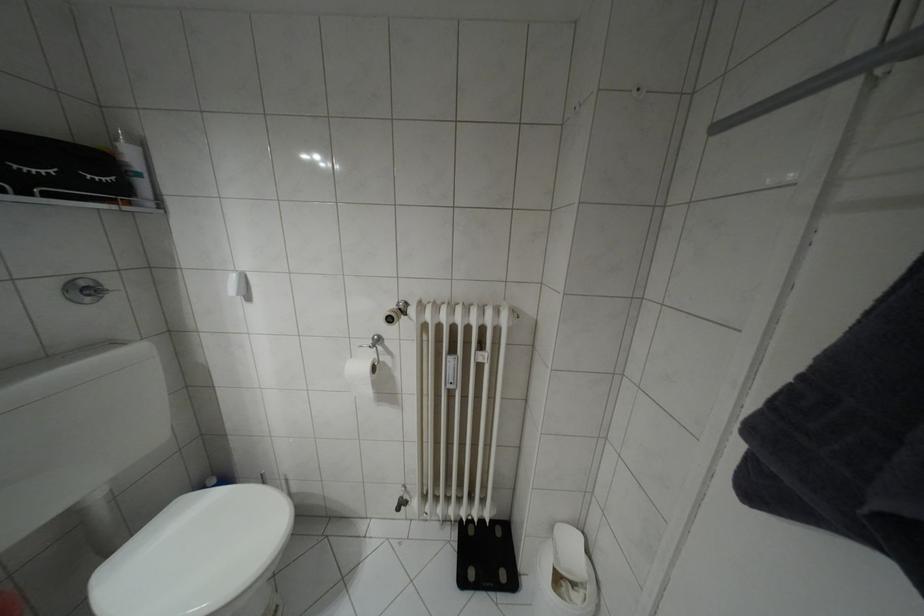
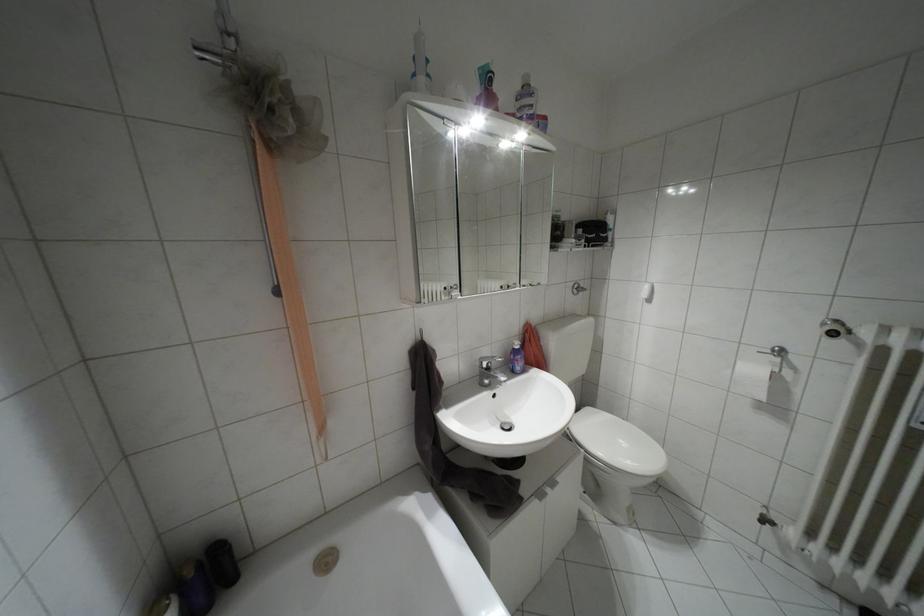
Question: The camera is either moving clockwise (left) or counter-clockwise (right) around the object. The first image is from the beginning of the video and the second image is from the end. Is the camera moving left or right when shooting the video?

Choices:
 (A) Left
 (B) Right

Answer: (B)